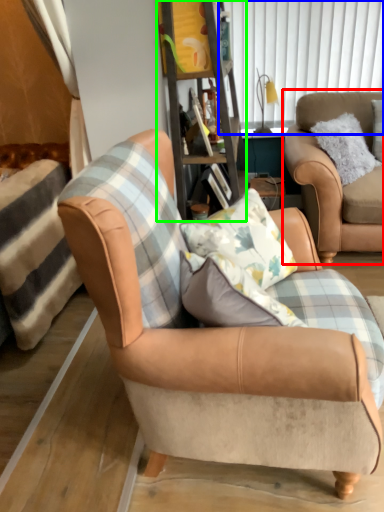
Question: Which object is positioned closest to chair (highlighted by a red box)? Select from window screen (highlighted by a blue box) and bookshelf (highlighted by a green box).

Choices:
 (A) window screen
 (B) bookshelf

Answer: (B)